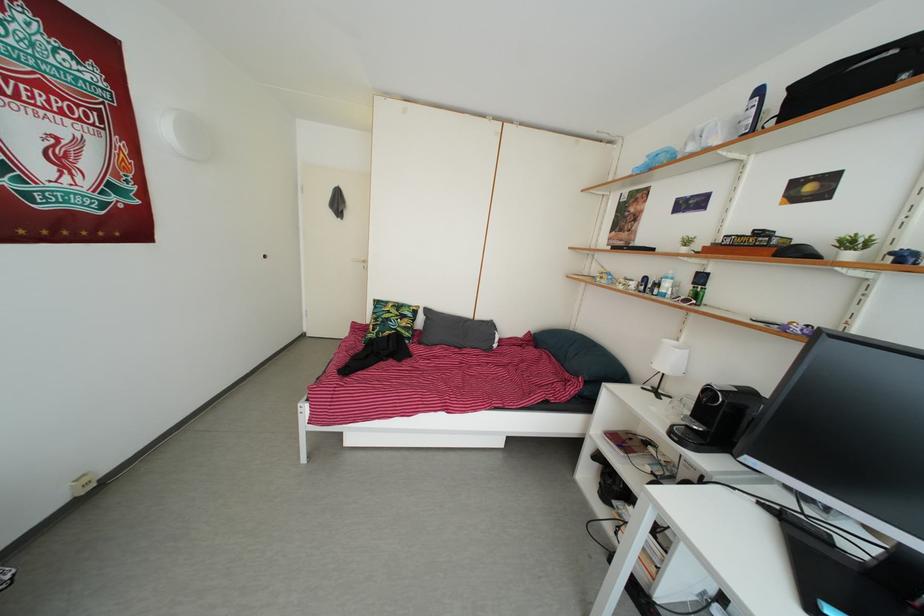
The image size is (924, 616). What do you see at coordinates (359, 262) in the screenshot?
I see `a white door handle` at bounding box center [359, 262].